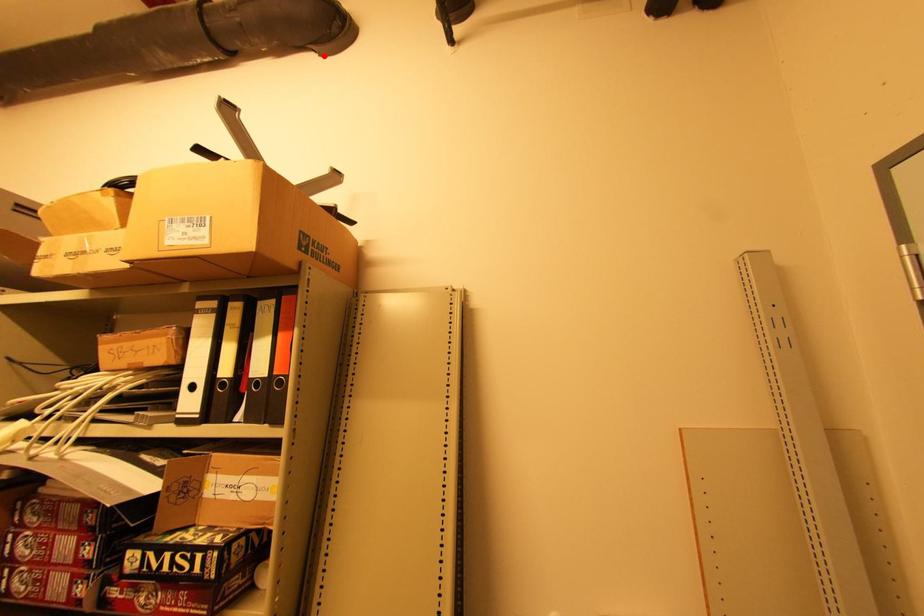
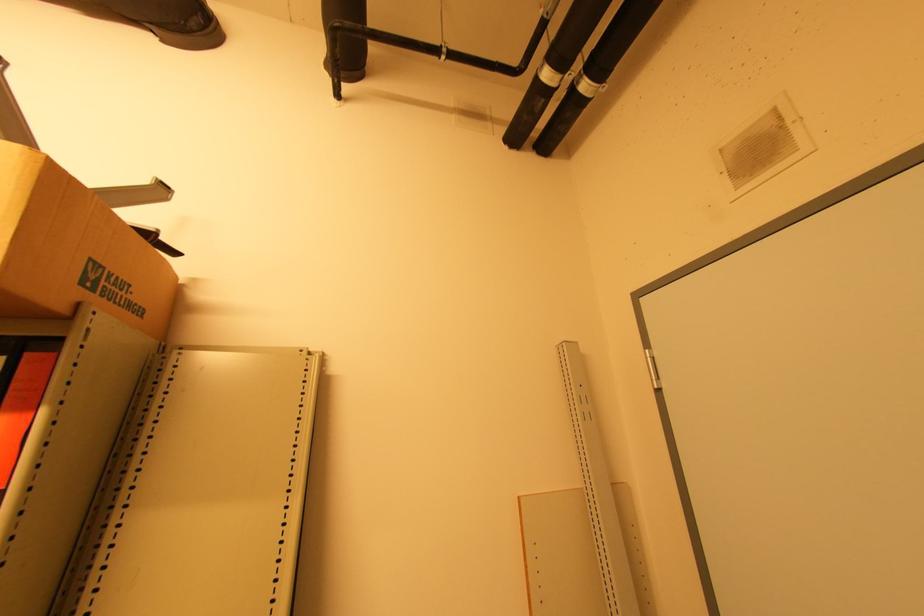
Find the pixel in the second image that matches the highlighted location in the first image.

(165, 42)